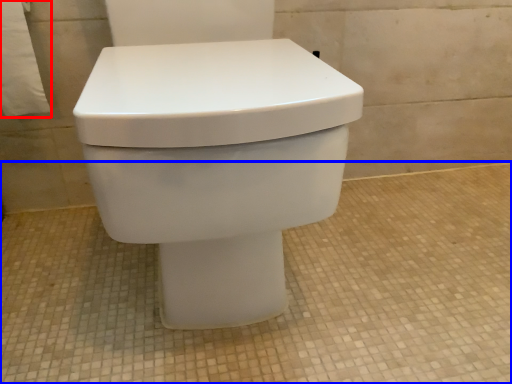
Question: Among these objects, which one is farthest to the camera, toilet paper (highlighted by a red box) or concrete (highlighted by a blue box)?

Choices:
 (A) toilet paper
 (B) concrete

Answer: (A)